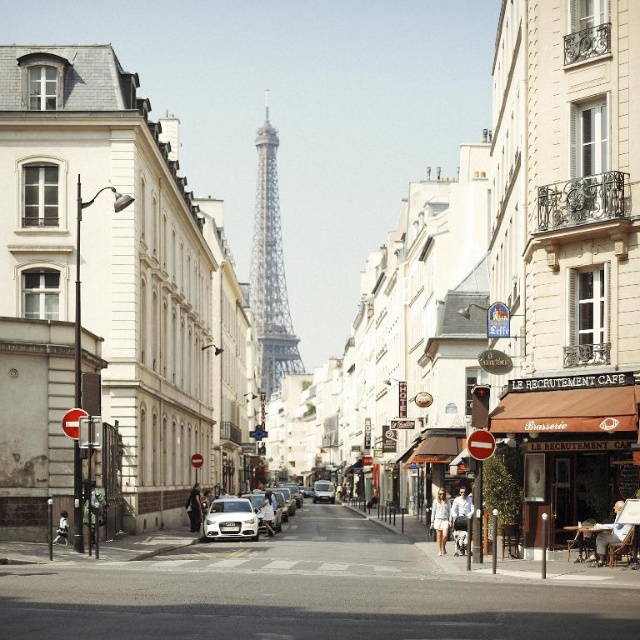
Question: Which of these objects is positioned closest to the light brown wooden chair at center?

Choices:
 (A) light blue denim jacket at center
 (B) white matte car at center

Answer: (A)

Question: Can you confirm if white matte car at center is smaller than satin silver car at center?

Choices:
 (A) no
 (B) yes

Answer: (A)

Question: Which object appears closest to the camera in this image?

Choices:
 (A) dark blue fabric coat at center
 (B) satin silver car at center
 (C) white cotton shirt at center
 (D) light brown wooden chair at center

Answer: (D)

Question: Based on their relative distances, which object is nearer to the light blue shirt at center?

Choices:
 (A) dark blue fabric coat at center
 (B) white matte car at center
 (C) satin silver car at center

Answer: (C)

Question: Does white matte car at center appear under satin silver car at center?

Choices:
 (A) no
 (B) yes

Answer: (B)

Question: Where is dark blue fabric coat at center located in relation to white cotton shirt at center in the image?

Choices:
 (A) right
 (B) left

Answer: (A)